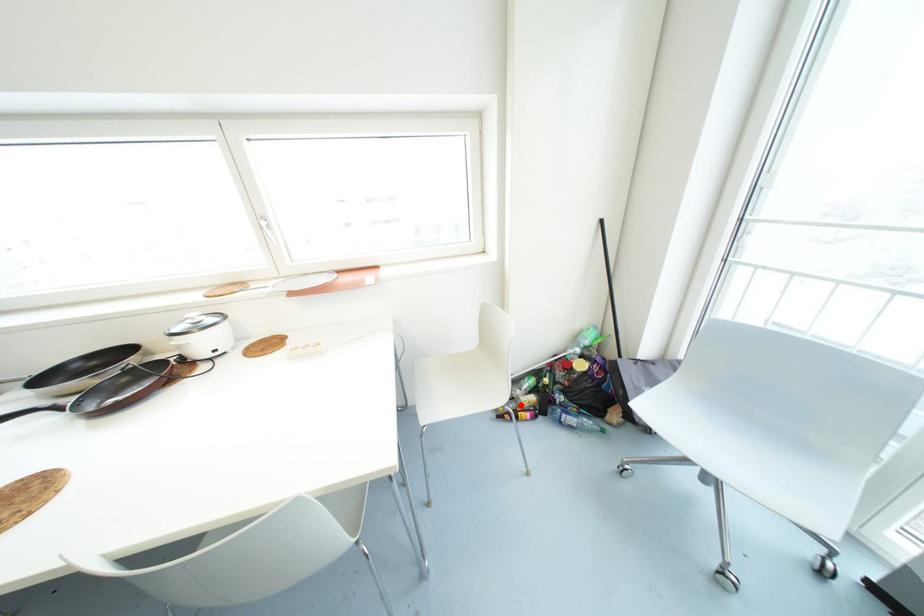
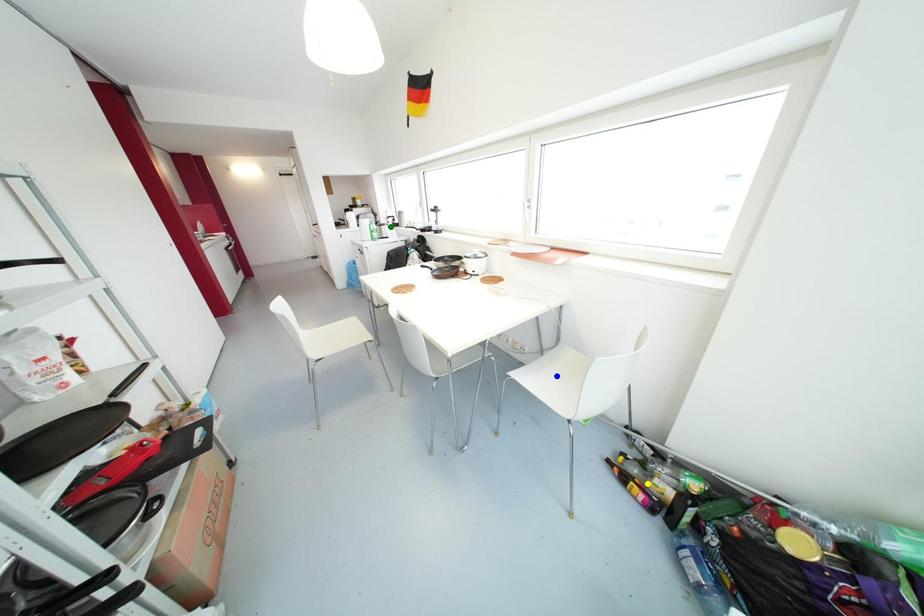
Question: I am providing you with two images of the same scene from different viewpoints. A red point is marked on the first image. You are given multiple points on the second image. Which point in image 2 is actually the same real-world point as the red point in image 1?

Choices:
 (A) yellow point
 (B) blue point
 (C) green point

Answer: (A)